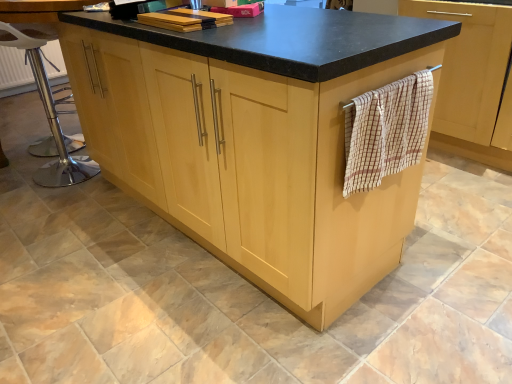
The image size is (512, 384). Identify the location of vacant space underneath wooden cutting board at upper center (from a real-world perspective). (183, 24).